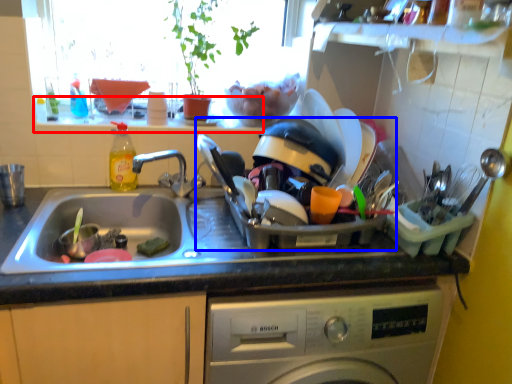
Question: Which object appears closest to the camera in this image, window sill (highlighted by a red box) or appliance (highlighted by a blue box)?

Choices:
 (A) window sill
 (B) appliance

Answer: (B)